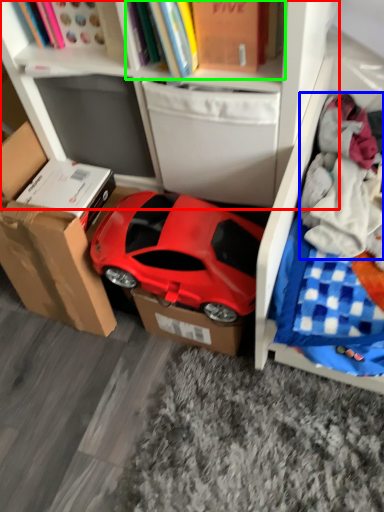
Question: Considering the real-world distances, which object is closest to bookcase (highlighted by a red box)? clothing (highlighted by a blue box) or book (highlighted by a green box).

Choices:
 (A) clothing
 (B) book

Answer: (B)